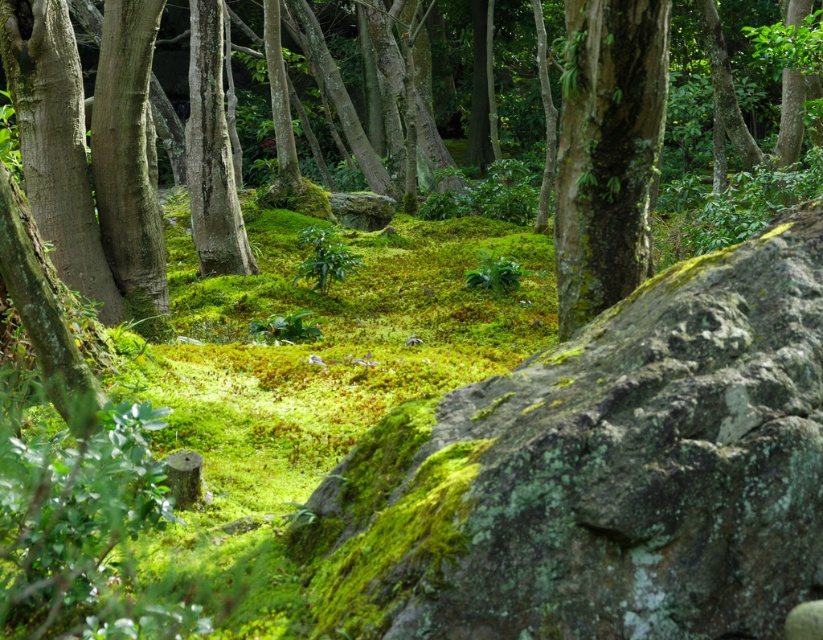
Question: In this image, where is green mossy bark at center located relative to smooth brown bark at left?

Choices:
 (A) above
 (B) below

Answer: (B)

Question: Which is farther from the green mossy bark at center?

Choices:
 (A) green mossy bark at left
 (B) smooth brown bark at left

Answer: (A)

Question: Is smooth brown bark at left above smooth bark tree trunk at center-left?

Choices:
 (A) yes
 (B) no

Answer: (B)

Question: Which of the following is the farthest from the observer?

Choices:
 (A) green mossy bark at center
 (B) green mossy bark at left

Answer: (B)

Question: Which object is farther from the camera taking this photo?

Choices:
 (A) smooth bark tree trunk at center-left
 (B) green mossy bark at left
 (C) green mossy bark at center

Answer: (A)

Question: Is green mossy bark at left closer to camera compared to smooth brown bark at left?

Choices:
 (A) no
 (B) yes

Answer: (B)